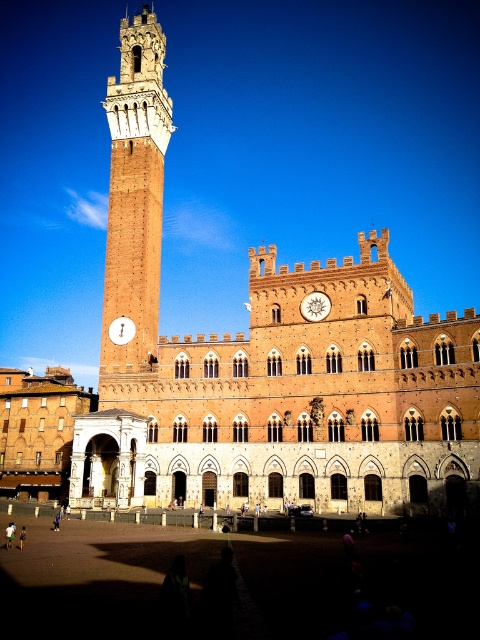
Question: Is the position of brown stone building at center less distant than that of wooden clock at center?

Choices:
 (A) no
 (B) yes

Answer: (B)

Question: Which point appears farthest from the camera in this image?

Choices:
 (A) (162, 136)
 (B) (110, 333)
 (C) (315, 314)
 (D) (370, 308)

Answer: (A)

Question: Which object is the closest to the brown brick bell tower at left?

Choices:
 (A) brown stone building at center
 (B) white glossy clock at center
 (C) wooden clock at center

Answer: (A)

Question: Which point is farther to the camera?

Choices:
 (A) (x=312, y=316)
 (B) (x=322, y=273)
 (C) (x=121, y=342)

Answer: (C)

Question: Is wooden clock at center wider than white glossy clock at center?

Choices:
 (A) no
 (B) yes

Answer: (B)

Question: Is brown stone building at center smaller than wooden clock at center?

Choices:
 (A) no
 (B) yes

Answer: (A)